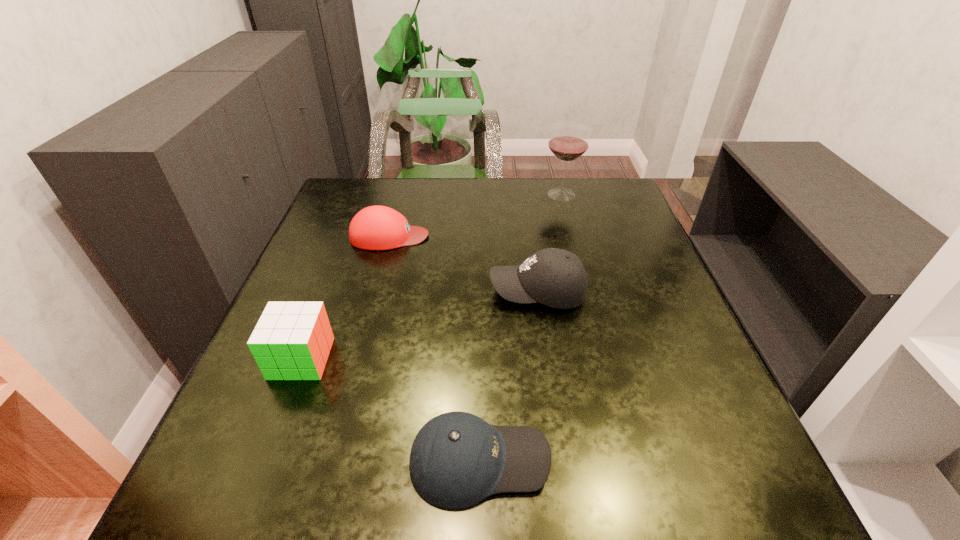
Where is `empty space that is in between the second nearest object and the tallest baseball cap`? The height and width of the screenshot is (540, 960). empty space that is in between the second nearest object and the tallest baseball cap is located at coordinates (420, 325).

Image resolution: width=960 pixels, height=540 pixels. Identify the location of vacant area between the leftmost baseball cap and the third farthest object. (464, 264).

You are a GUI agent. You are given a task and a screenshot of the screen. Output one action in this format:
    pyautogui.click(x=<x>, y=<y>)
    Task: Click on the free space between the farthest object and the nearest object
    
    Given the screenshot: What is the action you would take?
    pyautogui.click(x=520, y=327)

Where is `vacant area that lies between the farthest baseball cap and the cube`? The image size is (960, 540). vacant area that lies between the farthest baseball cap and the cube is located at coordinates (346, 297).

This screenshot has height=540, width=960. Find the location of `free spot between the cube and the nearest object`. free spot between the cube and the nearest object is located at coordinates (391, 409).

You are a GUI agent. You are given a task and a screenshot of the screen. Output one action in this format:
    pyautogui.click(x=<x>, y=<y>)
    Task: Click on the vacant point located between the nearest object and the third nearest object
    The height and width of the screenshot is (540, 960).
    Given the screenshot: What is the action you would take?
    pyautogui.click(x=509, y=376)

Find the location of `object that is the second closest to the farthest baseball cap`. object that is the second closest to the farthest baseball cap is located at coordinates (292, 340).

Locate which object ranks fourth in proximity to the fourth farthest object. Please provide its 2D coordinates. Your answer should be formatted as a tuple, i.e. [(x, y)], where the tuple contains the x and y coordinates of a point satisfying the conditions above.

[(568, 141)]

This screenshot has height=540, width=960. In order to click on baseball cap that stands as the second closest to the leftmost baseball cap in this screenshot , I will do `click(457, 459)`.

This screenshot has height=540, width=960. Find the location of `baseball cap that is the second closest one to the nearest object`. baseball cap that is the second closest one to the nearest object is located at coordinates (377, 227).